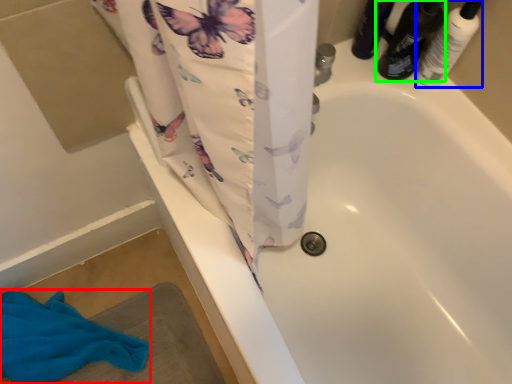
Question: Which object is positioned farthest from beach towel (highlighted by a red box)? Select from toiletry (highlighted by a blue box) and footwear (highlighted by a green box).

Choices:
 (A) toiletry
 (B) footwear

Answer: (A)